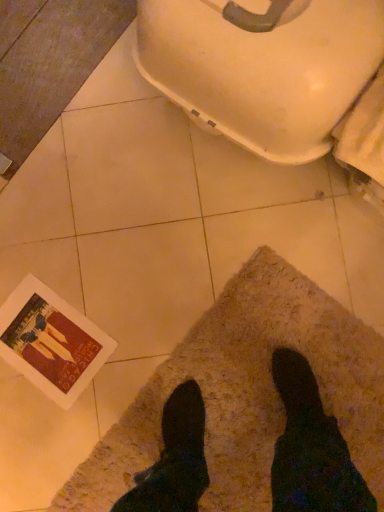
Find the location of a particular element. Image resolution: width=384 pixels, height=512 pixels. beige shaggy mat at lower center is located at coordinates (314, 305).

Image resolution: width=384 pixels, height=512 pixels. What do you see at coordinates (314, 305) in the screenshot? I see `beige shaggy mat at lower center` at bounding box center [314, 305].

Where is `white glossy toilet bowl at upper right`? white glossy toilet bowl at upper right is located at coordinates (262, 67).

What do you see at coordinates (262, 67) in the screenshot? I see `white glossy toilet bowl at upper right` at bounding box center [262, 67].

Locate an element on the screen. This screenshot has height=512, width=384. beige shaggy mat at lower center is located at coordinates (314, 305).

Is white glossy toilet bowl at upper right at the left side of beige shaggy mat at lower center?

Indeed, white glossy toilet bowl at upper right is positioned on the left side of beige shaggy mat at lower center.

Is the depth of white glossy toilet bowl at upper right greater than that of beige shaggy mat at lower center?

No.

Considering the points (288, 70) and (292, 282), which point is in front, point (288, 70) or point (292, 282)?

Positioned in front is point (288, 70).

From the image's perspective, is white glossy toilet bowl at upper right above or below beige shaggy mat at lower center?

white glossy toilet bowl at upper right is situated higher than beige shaggy mat at lower center in the image.

From a real-world perspective, which object rests below the other?

beige shaggy mat at lower center.

Is white glossy toilet bowl at upper right wider than beige shaggy mat at lower center?

Incorrect, the width of white glossy toilet bowl at upper right does not surpass that of beige shaggy mat at lower center.

From their relative heights in the image, would you say white glossy toilet bowl at upper right is taller or shorter than beige shaggy mat at lower center?

white glossy toilet bowl at upper right is taller than beige shaggy mat at lower center.

Between white glossy toilet bowl at upper right and beige shaggy mat at lower center, which one has larger size?

white glossy toilet bowl at upper right.

Is white glossy toilet bowl at upper right spatially inside beige shaggy mat at lower center, or outside of it?

white glossy toilet bowl at upper right is spatially situated outside beige shaggy mat at lower center.

Is white glossy toilet bowl at upper right not close to beige shaggy mat at lower center?

That's not correct — white glossy toilet bowl at upper right is a little close to beige shaggy mat at lower center.

Is white glossy toilet bowl at upper right facing towards beige shaggy mat at lower center?

No, white glossy toilet bowl at upper right is not facing towards beige shaggy mat at lower center.

Can you tell me how much white glossy toilet bowl at upper right and beige shaggy mat at lower center differ in facing direction?

179 degrees separate the facing orientations of white glossy toilet bowl at upper right and beige shaggy mat at lower center.

Measure the distance from white glossy toilet bowl at upper right to beige shaggy mat at lower center.

white glossy toilet bowl at upper right is 17.70 inches from beige shaggy mat at lower center.

The image size is (384, 512). In the image, there is a white glossy toilet bowl at upper right. In order to click on mat below it (from the image's perspective) in this screenshot , I will do `click(314, 305)`.

Considering the relative positions of beige shaggy mat at lower center and white glossy toilet bowl at upper right in the image provided, is beige shaggy mat at lower center to the right of white glossy toilet bowl at upper right from the viewer's perspective?

Correct, you'll find beige shaggy mat at lower center to the right of white glossy toilet bowl at upper right.

Is beige shaggy mat at lower center positioned before white glossy toilet bowl at upper right?

No, beige shaggy mat at lower center is further to the viewer.

Is point (378, 346) farther from camera compared to point (270, 35)?

That is True.

From the image's perspective, which one is positioned lower, beige shaggy mat at lower center or white glossy toilet bowl at upper right?

From the image's view, beige shaggy mat at lower center is below.

From the picture: From a real-world perspective, is beige shaggy mat at lower center physically located above or below white glossy toilet bowl at upper right?

From a real-world perspective, beige shaggy mat at lower center is physically below white glossy toilet bowl at upper right.

Does beige shaggy mat at lower center have a greater width compared to white glossy toilet bowl at upper right?

Indeed, beige shaggy mat at lower center has a greater width compared to white glossy toilet bowl at upper right.

Can you confirm if beige shaggy mat at lower center is shorter than white glossy toilet bowl at upper right?

Yes, beige shaggy mat at lower center is shorter than white glossy toilet bowl at upper right.

Looking at the image, does beige shaggy mat at lower center seem bigger or smaller compared to white glossy toilet bowl at upper right?

Considering their sizes, beige shaggy mat at lower center takes up less space than white glossy toilet bowl at upper right.

Can we say beige shaggy mat at lower center lies outside white glossy toilet bowl at upper right?

Yes, beige shaggy mat at lower center is outside of white glossy toilet bowl at upper right.

Is beige shaggy mat at lower center placed right next to white glossy toilet bowl at upper right?

No, beige shaggy mat at lower center is not in contact with white glossy toilet bowl at upper right.

Is beige shaggy mat at lower center turned away from white glossy toilet bowl at upper right?

beige shaggy mat at lower center is not turned away from white glossy toilet bowl at upper right.

Can you tell me how much beige shaggy mat at lower center and white glossy toilet bowl at upper right differ in facing direction?

179 degrees.

Measure the distance from beige shaggy mat at lower center to white glossy toilet bowl at upper right.

beige shaggy mat at lower center is 17.70 inches away from white glossy toilet bowl at upper right.

Where is `mat behind the white glossy toilet bowl at upper right`? This screenshot has height=512, width=384. mat behind the white glossy toilet bowl at upper right is located at coordinates (314, 305).

Where is `mat on the right of white glossy toilet bowl at upper right`? The width and height of the screenshot is (384, 512). mat on the right of white glossy toilet bowl at upper right is located at coordinates (314, 305).

In the image, there is a white glossy toilet bowl at upper right. In order to click on mat below it (from the image's perspective) in this screenshot , I will do tap(314, 305).